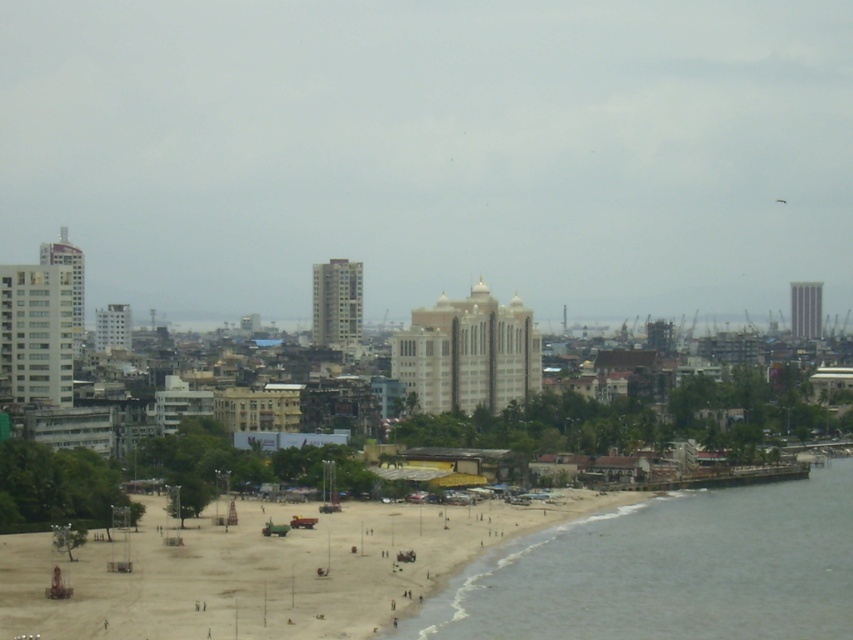
You are standing on the brown sand beach at lower right and want to walk to the matte white building at center. Which direction should you head?

You should head to the left because the matte white building at center is to the right of the brown sand beach at lower right, so moving left from the beach will lead towards the building.